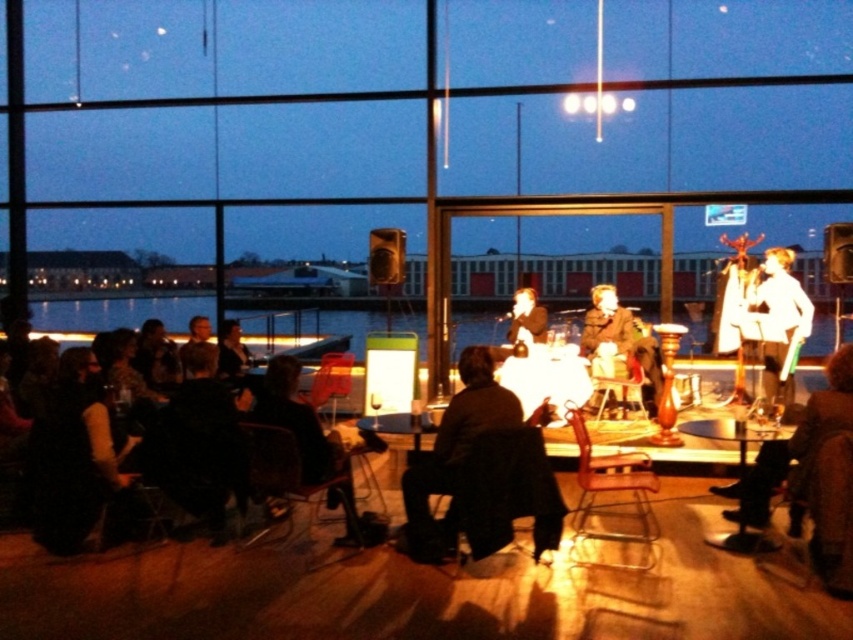
Between point (453, 468) and point (625, 348), which one is positioned in front?

Point (453, 468) is in front.

This screenshot has height=640, width=853. I want to click on dark brown leather jacket at center, so click(453, 454).

Is dark brown leather jacket at center to the right of leather jacket at lower right from the viewer's perspective?

Incorrect, dark brown leather jacket at center is not on the right side of leather jacket at lower right.

Between point (416, 488) and point (834, 401), which one is positioned behind?

The point (416, 488) is more distant.

Describe the element at coordinates (453, 454) in the screenshot. I see `dark brown leather jacket at center` at that location.

This screenshot has width=853, height=640. In order to click on dark brown leather jacket at center in this screenshot , I will do `click(453, 454)`.

Can you confirm if white glossy shirt at center is smaller than smooth black suit at center?

Incorrect, white glossy shirt at center is not smaller in size than smooth black suit at center.

What do you see at coordinates (778, 323) in the screenshot? I see `white glossy shirt at center` at bounding box center [778, 323].

This screenshot has height=640, width=853. In order to click on white glossy shirt at center in this screenshot , I will do `click(778, 323)`.